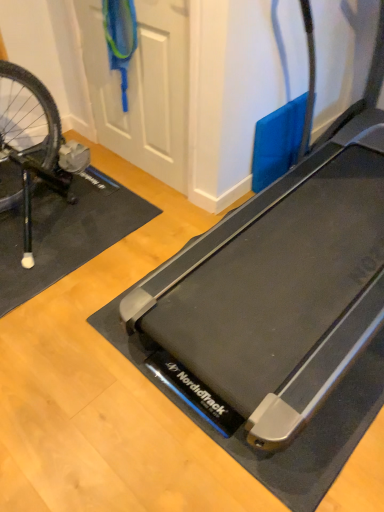
What do you see at coordinates (282, 282) in the screenshot? This screenshot has width=384, height=512. I see `black rubber treadmill at center` at bounding box center [282, 282].

Where is `black rubber yoga mat at left`? black rubber yoga mat at left is located at coordinates (65, 233).

What do you see at coordinates (65, 233) in the screenshot?
I see `black rubber yoga mat at left` at bounding box center [65, 233].

In order to click on black rubber treadmill at center in this screenshot , I will do `click(282, 282)`.

Which of these two, black rubber yoga mat at left or white matte door at upper center, is thinner?

With smaller width is white matte door at upper center.

Is black rubber yoga mat at left smaller than white matte door at upper center?

No.

Does black rubber yoga mat at left turn towards white matte door at upper center?

No.

Is point (56, 271) closer to camera compared to point (350, 124)?

Yes, it is in front of point (350, 124).

Is black rubber yoga mat at left touching black rubber treadmill at center?

No.

Is black rubber yoga mat at left facing away from black rubber treadmill at center?

No, black rubber yoga mat at left is not facing the opposite direction of black rubber treadmill at center.

Visually, is black rubber yoga mat at left positioned to the left or to the right of black rubber treadmill at center?

black rubber yoga mat at left is positioned on black rubber treadmill at center's left side.

What's the angular difference between white matte door at upper center and black rubber treadmill at center's facing directions?

0.477 degrees.

Considering the sizes of white matte door at upper center and black rubber treadmill at center in the image, is white matte door at upper center wider or thinner than black rubber treadmill at center?

Clearly, white matte door at upper center has less width compared to black rubber treadmill at center.

Based on the photo, from a real-world perspective, is white matte door at upper center positioned above or below black rubber treadmill at center?

white matte door at upper center is situated lower than black rubber treadmill at center in the real world.

Considering the sizes of white matte door at upper center and black rubber treadmill at center in the image, is white matte door at upper center bigger or smaller than black rubber treadmill at center?

Clearly, white matte door at upper center is smaller in size than black rubber treadmill at center.

In the image, is white matte door at upper center on the left side or the right side of black rubber yoga mat at left?

Clearly, white matte door at upper center is on the right of black rubber yoga mat at left in the image.

Is white matte door at upper center facing towards black rubber yoga mat at left?

Yes, white matte door at upper center faces towards black rubber yoga mat at left.

Consider the image. Is white matte door at upper center in front of or behind black rubber yoga mat at left in the image?

white matte door at upper center is positioned closer to the viewer than black rubber yoga mat at left.

Does point (163, 111) come in front of point (101, 250)?

No, it is not.

Is black rubber treadmill at center located outside white matte door at upper center?

Absolutely, black rubber treadmill at center is external to white matte door at upper center.

Is black rubber treadmill at center wider than white matte door at upper center?

Yes.

Is point (277, 262) positioned after point (116, 106)?

No, it is not.

In the scene shown: How different are the orientations of black rubber treadmill at center and white matte door at upper center in degrees?

The facing directions of black rubber treadmill at center and white matte door at upper center are 0.477 degrees apart.

Would you say black rubber treadmill at center is to the left or to the right of black rubber yoga mat at left in the picture?

In the image, black rubber treadmill at center appears on the right side of black rubber yoga mat at left.

Measure the distance between black rubber treadmill at center and black rubber yoga mat at left.

They are 29.28 inches apart.

Considering the sizes of objects black rubber treadmill at center and black rubber yoga mat at left in the image provided, who is thinner, black rubber treadmill at center or black rubber yoga mat at left?

With smaller width is black rubber yoga mat at left.

Is black rubber treadmill at center in contact with black rubber yoga mat at left?

No.

You are a GUI agent. You are given a task and a screenshot of the screen. Output one action in this format:
    pyautogui.click(x=<x>, y=<y>)
    Task: Click on the yoga mat on the left of white matte door at upper center
    The width and height of the screenshot is (384, 512).
    Given the screenshot: What is the action you would take?
    pyautogui.click(x=65, y=233)

Where is `treadmill above the black rubber yoga mat at left (from a real-world perspective)`? This screenshot has height=512, width=384. treadmill above the black rubber yoga mat at left (from a real-world perspective) is located at coordinates (282, 282).

From the image, which object appears to be nearer to black rubber yoga mat at left, white matte door at upper center or black rubber treadmill at center?

The object closer to black rubber yoga mat at left is white matte door at upper center.

Considering their positions, is black rubber yoga mat at left positioned closer to white matte door at upper center than black rubber treadmill at center?

The object closer to white matte door at upper center is black rubber yoga mat at left.

When comparing their distances from black rubber yoga mat at left, does black rubber treadmill at center or white matte door at upper center seem further?

Among the two, black rubber treadmill at center is located further to black rubber yoga mat at left.

Estimate the real-world distances between objects in this image. Which object is further from black rubber treadmill at center, white matte door at upper center or black rubber yoga mat at left?

Based on the image, white matte door at upper center appears to be further to black rubber treadmill at center.

From the image, which object appears to be nearer to black rubber treadmill at center, black rubber yoga mat at left or white matte door at upper center?

Based on the image, black rubber yoga mat at left appears to be nearer to black rubber treadmill at center.

Which object lies nearer to the anchor point white matte door at upper center, black rubber treadmill at center or black rubber yoga mat at left?

black rubber yoga mat at left is closer to white matte door at upper center.

Locate an element on the screen. The width and height of the screenshot is (384, 512). door between black rubber treadmill at center and black rubber yoga mat at left in the front-back direction is located at coordinates (142, 88).